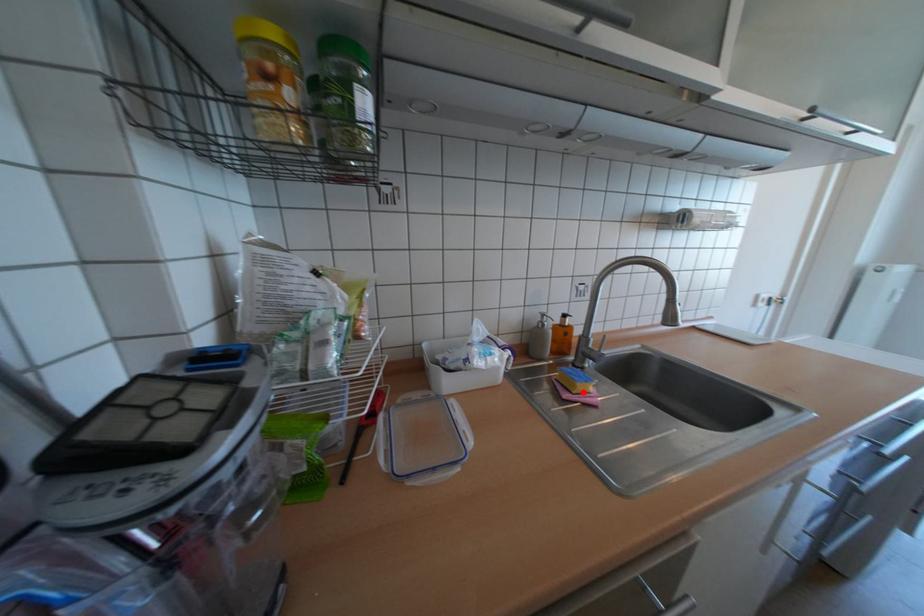
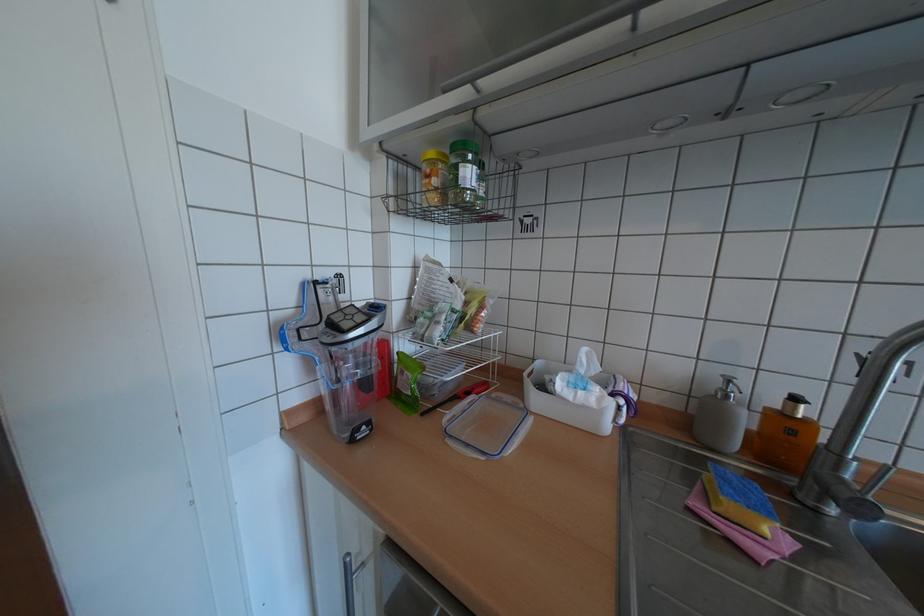
The point at the highlighted location is marked in the first image. Where is the corresponding point in the second image?

(723, 508)